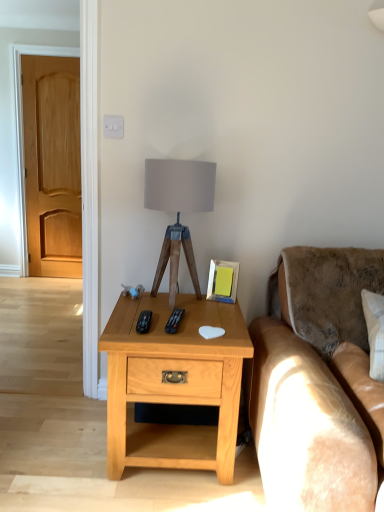
The height and width of the screenshot is (512, 384). I want to click on free location to the left of black plastic remote at center, the 2th remote when ordered from left to right, so click(x=135, y=324).